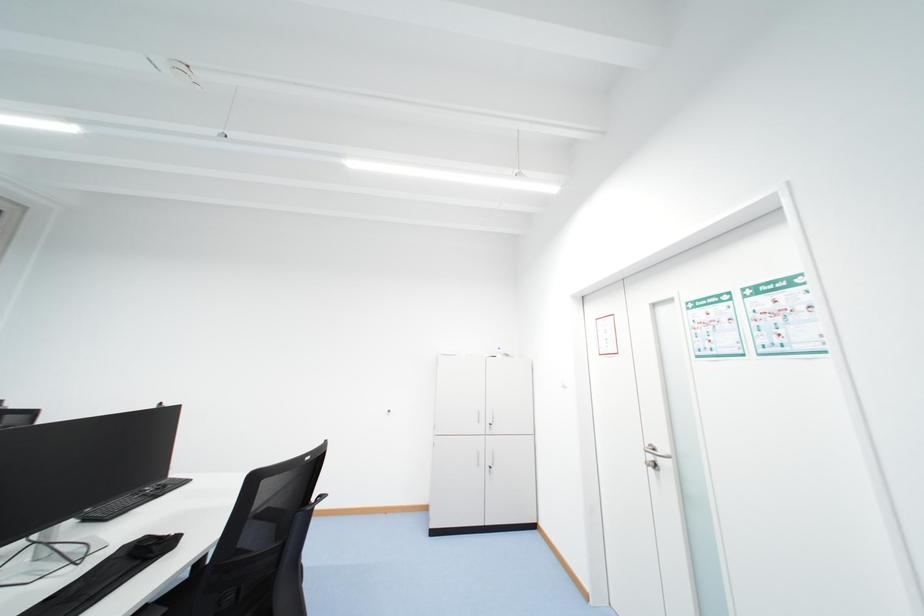
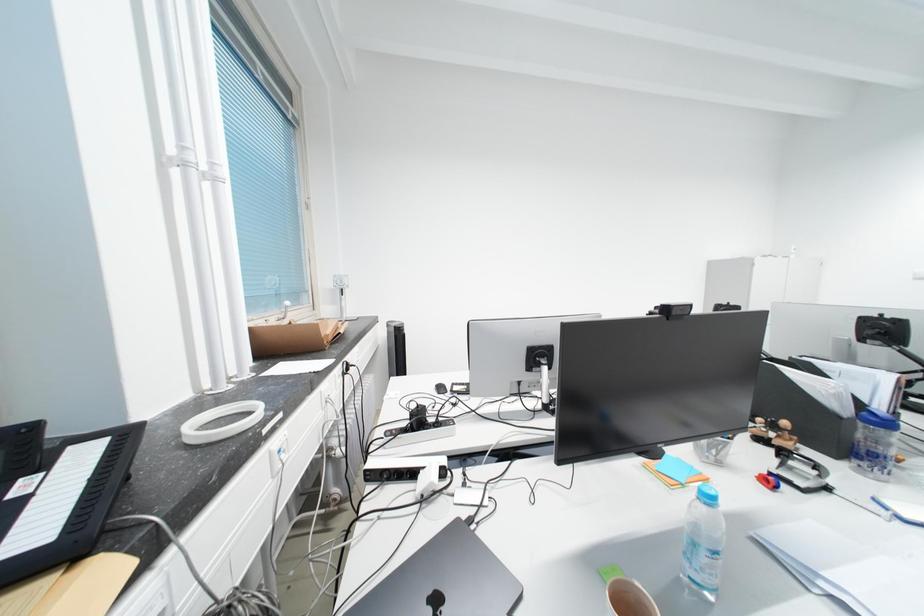
Question: The images are taken continuously from a first-person perspective. In which direction are you moving?

Choices:
 (A) Left
 (B) Right
 (C) Forward
 (D) Backward

Answer: (A)